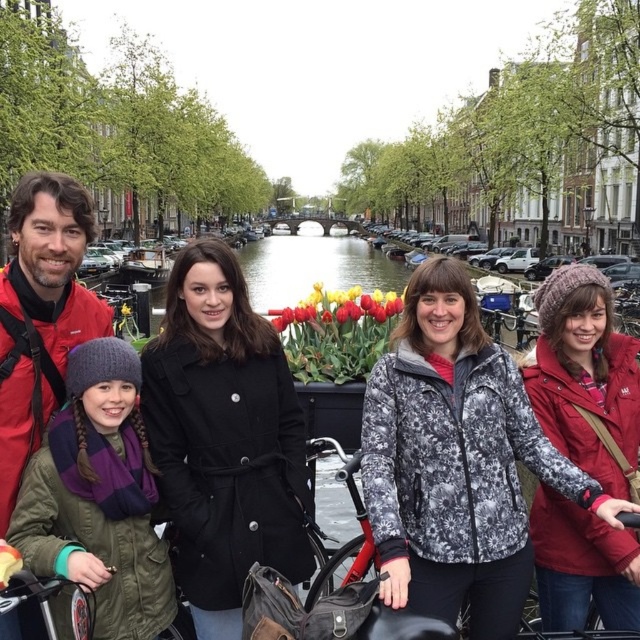
Who is lower down, black matte coat at center or matte black coat at center?

Positioned lower is black matte coat at center.

Where is `black matte coat at center`? black matte coat at center is located at coordinates (225, 438).

I want to click on black matte coat at center, so click(x=225, y=438).

Does matte black coat at center appear on the left side of red fleece jacket at lower right?

Correct, you'll find matte black coat at center to the left of red fleece jacket at lower right.

Can you confirm if matte black coat at center is thinner than red fleece jacket at lower right?

Incorrect, matte black coat at center's width is not less than red fleece jacket at lower right's.

Describe the element at coordinates (44, 292) in the screenshot. I see `matte black coat at center` at that location.

This screenshot has height=640, width=640. What are the coordinates of `matte black coat at center` in the screenshot? It's located at [44, 292].

Is red fleece jacket at lower right to the right of red matte bicycle at center from the viewer's perspective?

Indeed, red fleece jacket at lower right is positioned on the right side of red matte bicycle at center.

Does red fleece jacket at lower right have a greater height compared to red matte bicycle at center?

Yes, red fleece jacket at lower right is taller than red matte bicycle at center.

Is point (605, 376) farther from camera compared to point (365, 548)?

Yes, it is.

You are a GUI agent. You are given a task and a screenshot of the screen. Output one action in this format:
    pyautogui.click(x=<x>, y=<y>)
    Task: Click on the red fleece jacket at lower right
    
    Given the screenshot: What is the action you would take?
    pyautogui.click(x=586, y=378)